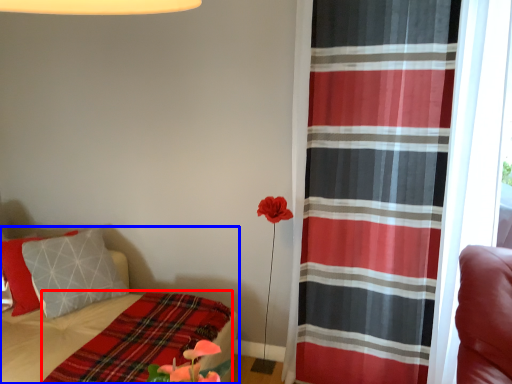
Question: Which object appears closest to the camera in this image, blanket (highlighted by a red box) or bed (highlighted by a blue box)?

Choices:
 (A) blanket
 (B) bed

Answer: (B)